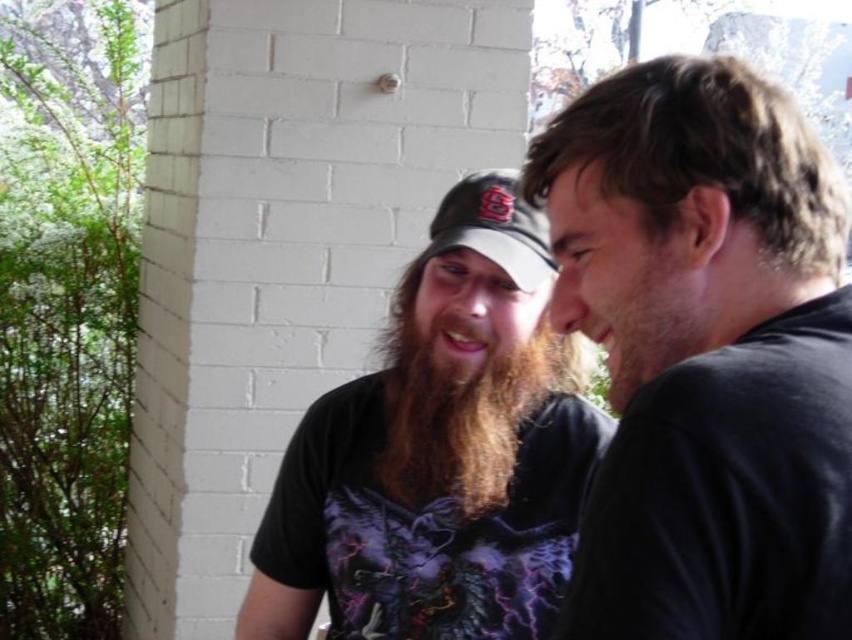
You are a photographer trying to frame two people in a photo. You notice the dark brown hair at upper right and the curly brown hair at right. Which hair is wider?

The curly brown hair at right is wider than the dark brown hair at upper right.

You are a photographer trying to capture both dark brown hair at upper right and curly brown hair at right in a single frame. Given their sizes, which one might need to be positioned closer to the camera to ensure both appear similarly sized in the photo?

The curly brown hair at right should be positioned closer to the camera because it is smaller in size than the dark brown hair at upper right, so moving it closer would help balance their apparent sizes in the photo.